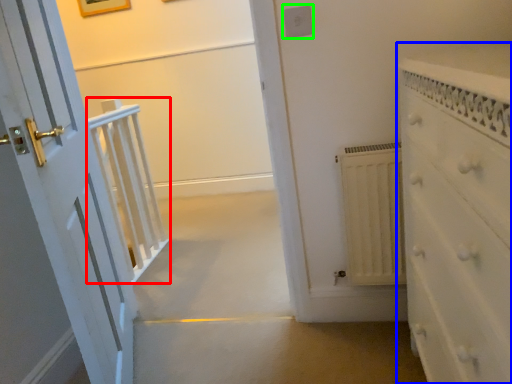
Question: Based on their relative distances, which object is nearer to balustrade (highlighted by a red box)? Choose from chest of drawers (highlighted by a blue box) and electric outlet (highlighted by a green box).

Choices:
 (A) chest of drawers
 (B) electric outlet

Answer: (B)